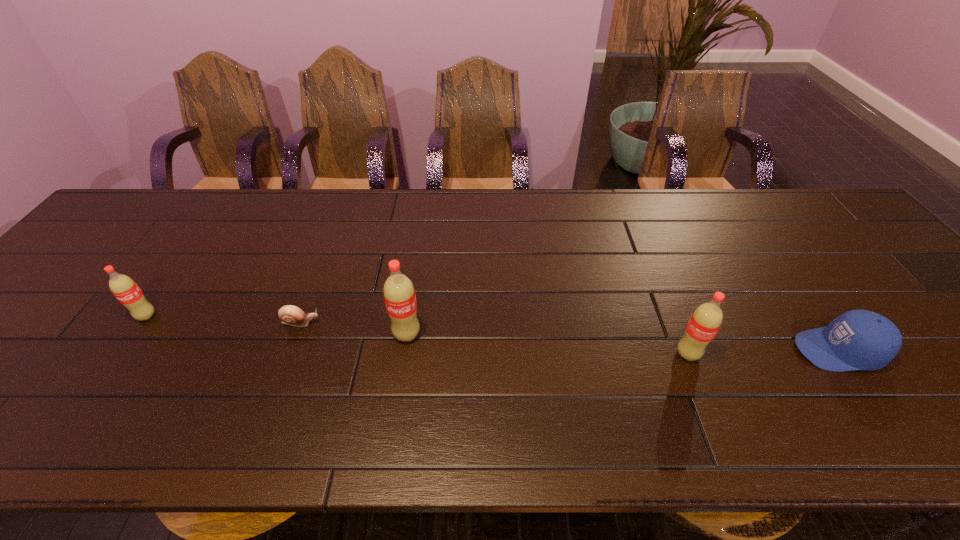
The width and height of the screenshot is (960, 540). In order to click on free space located 0.280m on the left of the second soda from right to left in this screenshot , I will do `click(273, 334)`.

This screenshot has height=540, width=960. In order to click on blank space located on the back of the second shortest soda in this screenshot , I will do `click(666, 301)`.

What are the coordinates of `free space located on the front-facing side of the shortest object` in the screenshot? It's located at (417, 322).

Locate an element on the screen. The width and height of the screenshot is (960, 540). free space located on the front-facing side of the rightmost object is located at coordinates (681, 350).

I want to click on free region located 0.240m on the front-facing side of the rightmost object, so click(x=689, y=350).

Image resolution: width=960 pixels, height=540 pixels. I want to click on vacant space located on the front-facing side of the rightmost object, so click(628, 350).

Find the location of `object present at the near edge`. object present at the near edge is located at coordinates (858, 339).

Where is `vacant space at the far edge of the desktop`? The image size is (960, 540). vacant space at the far edge of the desktop is located at coordinates (375, 208).

Where is `blank space at the near edge of the desktop`? blank space at the near edge of the desktop is located at coordinates tap(331, 395).

At what (x,y) coordinates should I click in order to perform the action: click on vacant space at the left edge of the desktop. Please return your answer as a coordinate pair (x, y). Looking at the image, I should click on (36, 338).